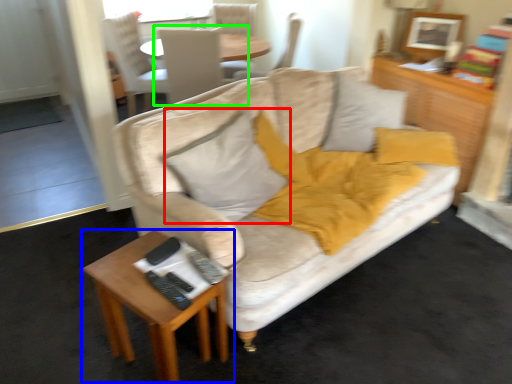
Question: Which object is positioned closest to pillow (highlighted by a red box)? Select from table (highlighted by a blue box) and chair (highlighted by a green box).

Choices:
 (A) table
 (B) chair

Answer: (A)